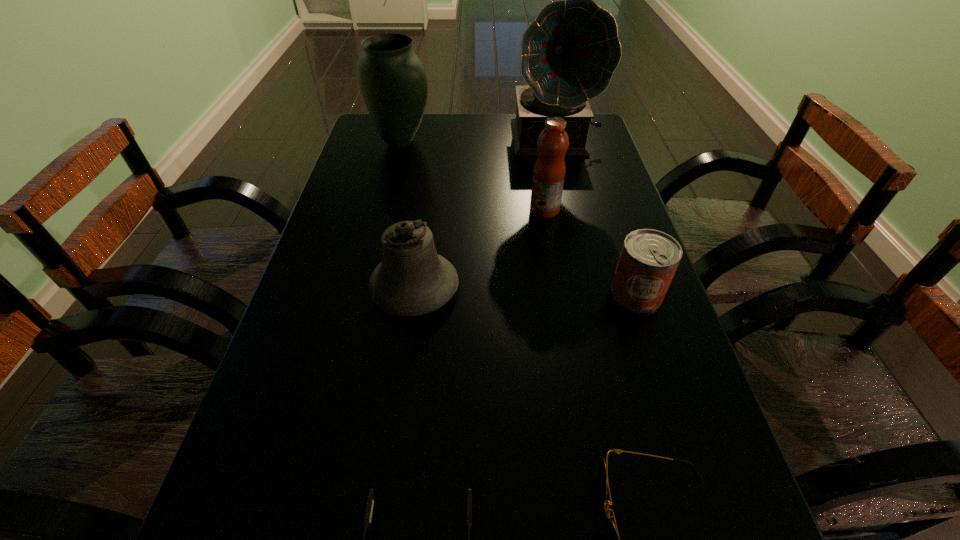
Find the location of a particular element. This screenshot has height=540, width=960. object that is at the far right corner is located at coordinates (570, 51).

The width and height of the screenshot is (960, 540). What are the coordinates of `free location at the far edge` in the screenshot? It's located at (412, 144).

Identify the location of vacant space at the left edge of the desktop. (360, 227).

Locate an element on the screen. free space at the right edge of the desktop is located at coordinates (690, 393).

Where is `free space between the fruit juice and the vase`? Image resolution: width=960 pixels, height=540 pixels. free space between the fruit juice and the vase is located at coordinates tap(472, 176).

Image resolution: width=960 pixels, height=540 pixels. In order to click on free space between the fruit juice and the vase in this screenshot , I will do `click(472, 176)`.

You are a GUI agent. You are given a task and a screenshot of the screen. Output one action in this format:
    pyautogui.click(x=<x>, y=<y>)
    Task: Click on the unoccupied position between the fruit juice and the fourth shortest object
    This screenshot has width=960, height=540.
    Given the screenshot: What is the action you would take?
    pyautogui.click(x=480, y=249)

This screenshot has width=960, height=540. What are the coordinates of `the fourth closest object to the taller sunglasses` in the screenshot? It's located at (549, 171).

Identify the location of object that stands as the sixth closest to the bell. (392, 79).

Find the location of `free space in the image that satisfies the following two spatial constraints: 1. on the front side of the sixth shortest object; 2. on the right side of the fourth shortest object`. free space in the image that satisfies the following two spatial constraints: 1. on the front side of the sixth shortest object; 2. on the right side of the fourth shortest object is located at coordinates (365, 289).